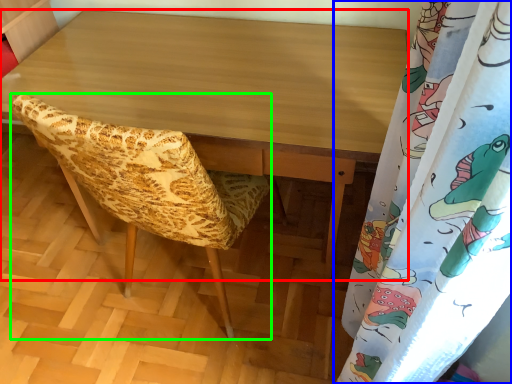
Question: Which object is positioned farthest from desk (highlighted by a red box)? Select from curtain (highlighted by a blue box) and furniture (highlighted by a green box).

Choices:
 (A) curtain
 (B) furniture

Answer: (A)